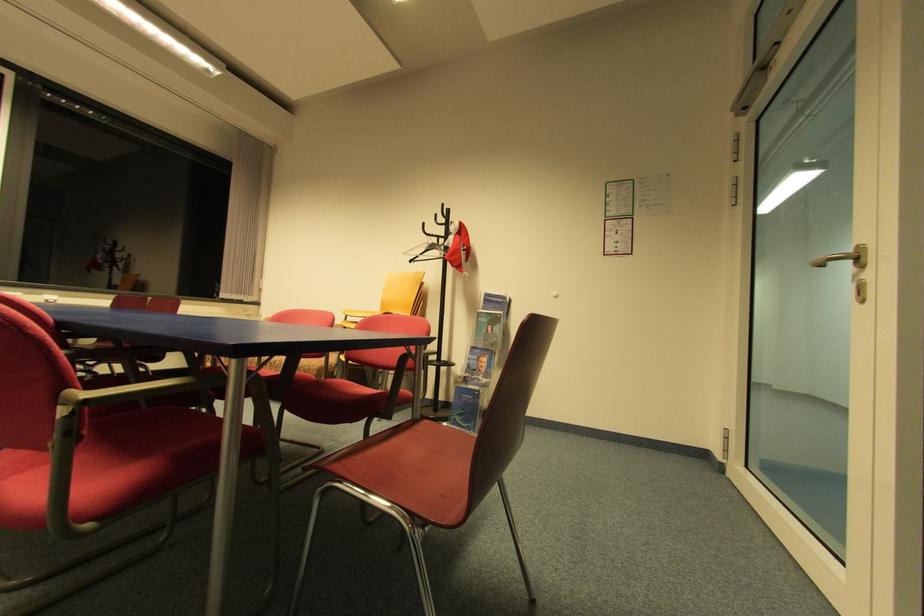
Find where to turn the gold door handle. Please return your answer as a coordinate pair (x, y).

(857, 256)